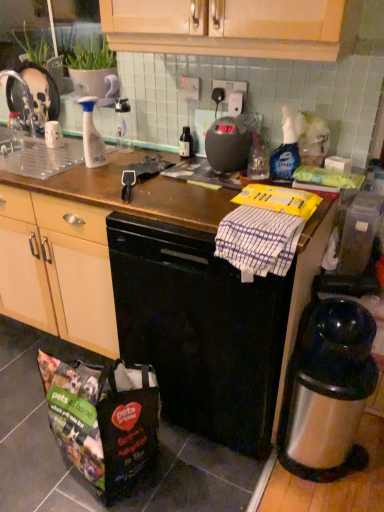
Identify the location of vacant area situated to the left side of translucent plastic spray bottle at center-left, marked as the 1th bottle in a left-to-right arrangement. The width and height of the screenshot is (384, 512). (57, 167).